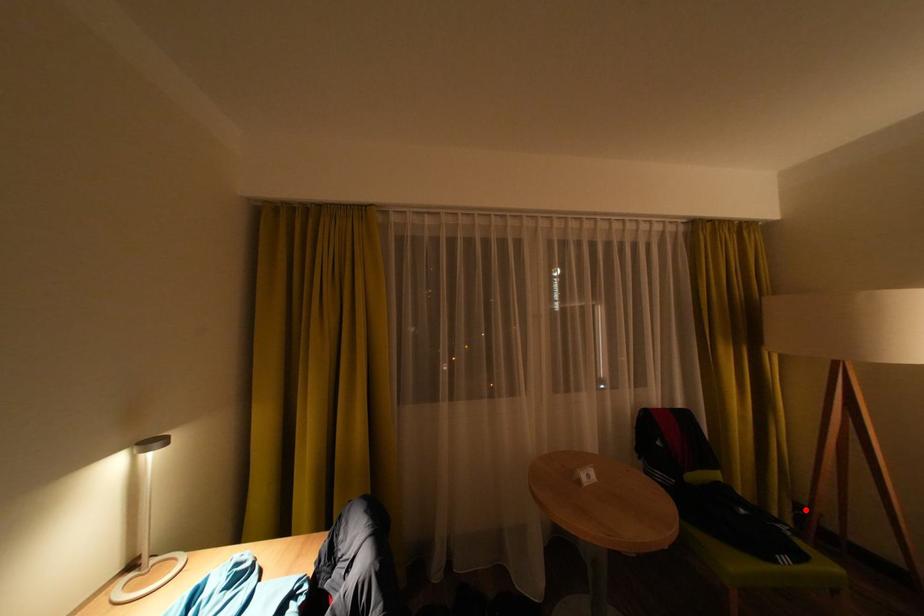
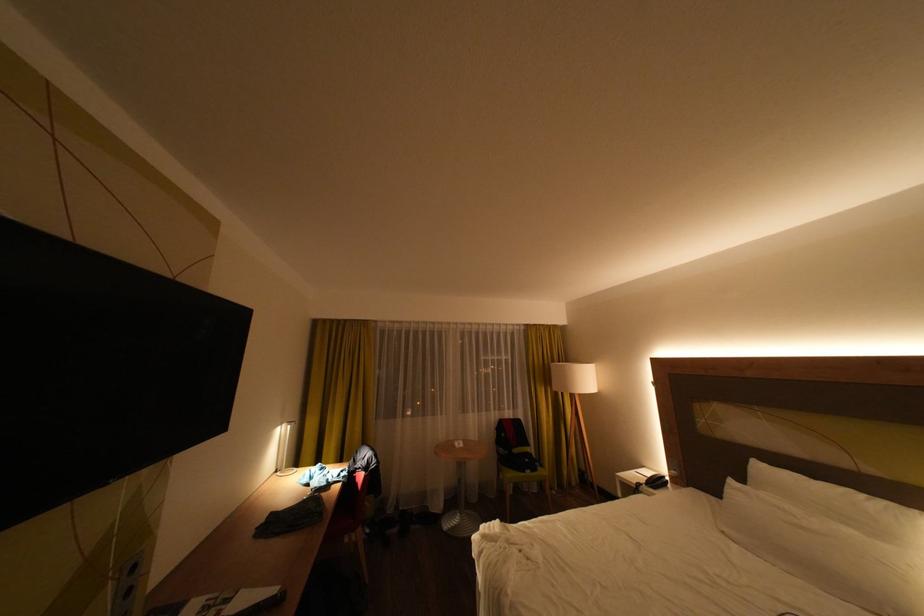
Locate, in the second image, the point that corresponds to the highlighted location in the first image.

(590, 472)